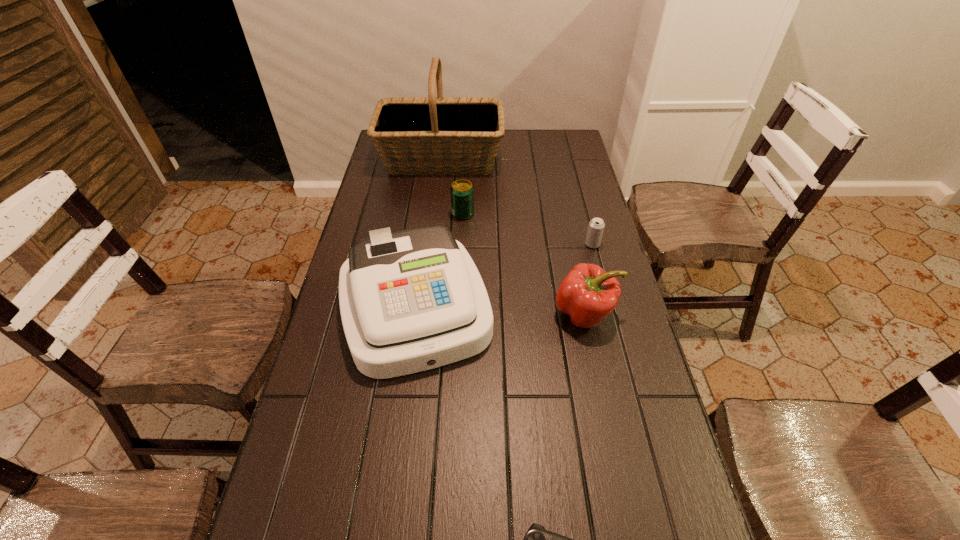
Where is `free region that satisfies the following two spatial constraints: 1. by the handle of the farthest object; 2. on the left side of the second shortest object`? free region that satisfies the following two spatial constraints: 1. by the handle of the farthest object; 2. on the left side of the second shortest object is located at coordinates (431, 244).

In order to click on vacant region that satisfies the following two spatial constraints: 1. on the back side of the right beer can; 2. by the handle of the farthest object in this screenshot , I will do `click(570, 160)`.

Locate an element on the screen. The width and height of the screenshot is (960, 540). free space that satisfies the following two spatial constraints: 1. by the handle of the farthest object; 2. on the left side of the taller beer can is located at coordinates (435, 214).